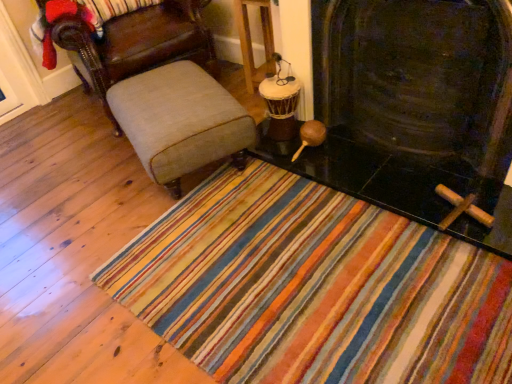
Question: From a real-world perspective, is light beige fabric chair at left on black stone fireplace at center?

Choices:
 (A) no
 (B) yes

Answer: (A)

Question: Is light beige fabric chair at left smaller than black stone fireplace at center?

Choices:
 (A) no
 (B) yes

Answer: (A)

Question: Considering the relative sizes of light beige fabric chair at left and black stone fireplace at center in the image provided, is light beige fabric chair at left wider than black stone fireplace at center?

Choices:
 (A) no
 (B) yes

Answer: (B)

Question: Are light beige fabric chair at left and black stone fireplace at center beside each other?

Choices:
 (A) yes
 (B) no

Answer: (B)

Question: Would you say light beige fabric chair at left contains black stone fireplace at center?

Choices:
 (A) no
 (B) yes

Answer: (A)

Question: In terms of size, does beige fabric ottoman at center appear bigger or smaller than wooden drum at center?

Choices:
 (A) small
 (B) big

Answer: (B)

Question: Is point (179, 99) positioned closer to the camera than point (266, 21)?

Choices:
 (A) farther
 (B) closer

Answer: (B)

Question: Which is correct: beige fabric ottoman at center is inside wooden drum at center, or outside of it?

Choices:
 (A) inside
 (B) outside

Answer: (B)

Question: Is beige fabric ottoman at center taller or shorter than wooden drum at center?

Choices:
 (A) short
 (B) tall

Answer: (A)

Question: Considering the positions of black stone fireplace at center and wooden drum at center in the image, is black stone fireplace at center taller or shorter than wooden drum at center?

Choices:
 (A) tall
 (B) short

Answer: (A)

Question: From a real-world perspective, is black stone fireplace at center physically located above or below wooden drum at center?

Choices:
 (A) above
 (B) below

Answer: (A)

Question: From the image's perspective, is black stone fireplace at center above or below wooden drum at center?

Choices:
 (A) above
 (B) below

Answer: (B)

Question: Considering the relative positions of black stone fireplace at center and wooden drum at center in the image provided, is black stone fireplace at center to the left or to the right of wooden drum at center?

Choices:
 (A) left
 (B) right

Answer: (B)

Question: Relative to light beige fabric chair at left, is beige fabric ottoman at center in front or behind?

Choices:
 (A) front
 (B) behind

Answer: (A)

Question: Looking at their shapes, would you say beige fabric ottoman at center is wider or thinner than light beige fabric chair at left?

Choices:
 (A) wide
 (B) thin

Answer: (B)